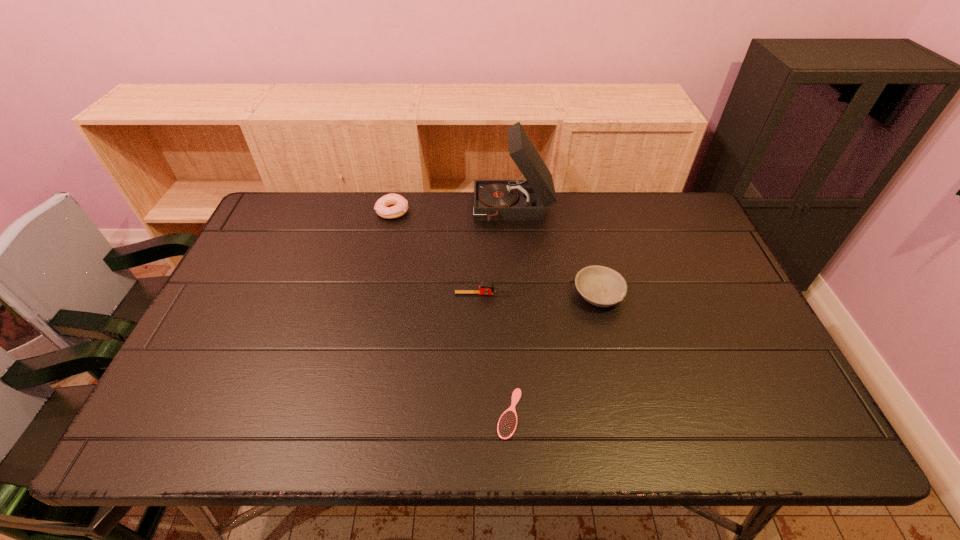
Identify the location of vacant point located between the bowl and the tape measure. (541, 294).

Locate an element on the screen. The width and height of the screenshot is (960, 540). vacant point located between the tallest object and the shortest object is located at coordinates (512, 312).

The image size is (960, 540). I want to click on free space between the tallest object and the doughnut, so click(x=453, y=211).

The width and height of the screenshot is (960, 540). In order to click on unoccupied position between the hairbrush and the tape measure in this screenshot , I will do `click(496, 354)`.

At what (x,y) coordinates should I click in order to perform the action: click on free space between the phonograph_record and the nearest object. Please return your answer as a coordinate pair (x, y). Image resolution: width=960 pixels, height=540 pixels. Looking at the image, I should click on (512, 312).

Find the location of `vacant space that is in between the rightmost object and the tallest object`. vacant space that is in between the rightmost object and the tallest object is located at coordinates (556, 252).

Image resolution: width=960 pixels, height=540 pixels. Find the location of `unoccupied area between the bowl and the shortest object`. unoccupied area between the bowl and the shortest object is located at coordinates (554, 354).

You are a GUI agent. You are given a task and a screenshot of the screen. Output one action in this format:
    pyautogui.click(x=<x>, y=<y>)
    Task: Click on the vacant point located between the leftmost object and the rightmost object
    
    Given the screenshot: What is the action you would take?
    pyautogui.click(x=495, y=253)

Where is `free space between the bowl and the tape measure`? free space between the bowl and the tape measure is located at coordinates (541, 294).

Where is `vacant point located between the doughnut and the shortest object`? The image size is (960, 540). vacant point located between the doughnut and the shortest object is located at coordinates (451, 313).